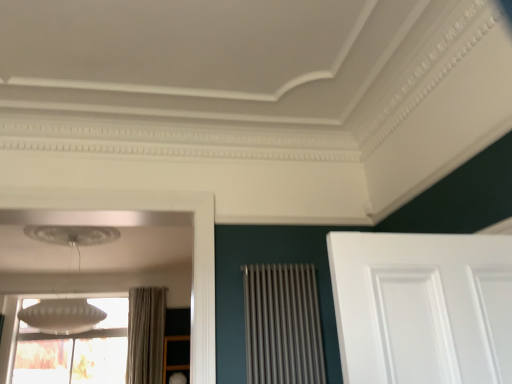
Question: Considering the relative sizes of white frosted glass window at lower left and white frosted glass lampshade at upper left in the image provided, is white frosted glass window at lower left taller than white frosted glass lampshade at upper left?

Choices:
 (A) no
 (B) yes

Answer: (B)

Question: From a real-world perspective, is white frosted glass window at lower left physically below white frosted glass lampshade at upper left?

Choices:
 (A) yes
 (B) no

Answer: (A)

Question: Is white frosted glass window at lower left shorter than white frosted glass lampshade at upper left?

Choices:
 (A) yes
 (B) no

Answer: (B)

Question: Can you confirm if white frosted glass window at lower left is positioned to the right of white frosted glass lampshade at upper left?

Choices:
 (A) yes
 (B) no

Answer: (B)

Question: Does white frosted glass window at lower left have a lesser width compared to white frosted glass lampshade at upper left?

Choices:
 (A) yes
 (B) no

Answer: (A)

Question: Is white frosted glass window at lower left to the left of white frosted glass lampshade at upper left from the viewer's perspective?

Choices:
 (A) yes
 (B) no

Answer: (A)

Question: Is metallic silver radiator at center far from matte gray curtain at left?

Choices:
 (A) yes
 (B) no

Answer: (A)

Question: Would you say metallic silver radiator at center contains matte gray curtain at left?

Choices:
 (A) yes
 (B) no

Answer: (B)

Question: Is metallic silver radiator at center looking in the opposite direction of matte gray curtain at left?

Choices:
 (A) yes
 (B) no

Answer: (A)

Question: Considering the relative sizes of metallic silver radiator at center and matte gray curtain at left in the image provided, is metallic silver radiator at center taller than matte gray curtain at left?

Choices:
 (A) yes
 (B) no

Answer: (B)

Question: Considering the relative positions of metallic silver radiator at center and matte gray curtain at left in the image provided, is metallic silver radiator at center behind matte gray curtain at left?

Choices:
 (A) no
 (B) yes

Answer: (A)

Question: Is metallic silver radiator at center to the right of matte gray curtain at left from the viewer's perspective?

Choices:
 (A) yes
 (B) no

Answer: (A)

Question: Can you confirm if matte gray curtain at left is positioned to the left of white frosted glass lampshade at upper left?

Choices:
 (A) no
 (B) yes

Answer: (A)